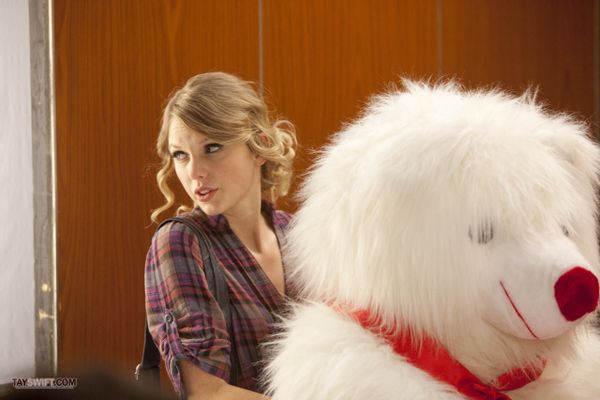
Locate an element on the screen. stuffed animal eyes is located at coordinates (487, 238), (554, 239).